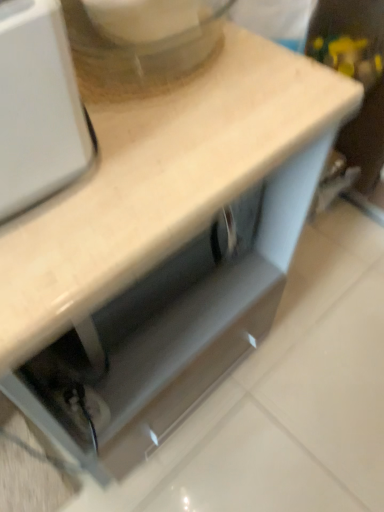
Question: Considering their positions, is white plastic mixer at upper left located in front of or behind white matte countertop at upper center?

Choices:
 (A) front
 (B) behind

Answer: (B)

Question: Looking at the image, does white plastic mixer at upper left seem bigger or smaller compared to white matte countertop at upper center?

Choices:
 (A) small
 (B) big

Answer: (A)

Question: From a real-world perspective, is white plastic mixer at upper left above or below white matte countertop at upper center?

Choices:
 (A) above
 (B) below

Answer: (A)

Question: From the image's perspective, is white matte countertop at upper center above or below white plastic mixer at upper left?

Choices:
 (A) above
 (B) below

Answer: (B)

Question: Looking at their shapes, would you say white matte countertop at upper center is wider or thinner than white plastic mixer at upper left?

Choices:
 (A) thin
 (B) wide

Answer: (B)

Question: Would you say white matte countertop at upper center is inside or outside white plastic mixer at upper left?

Choices:
 (A) outside
 (B) inside

Answer: (A)

Question: In terms of size, does white matte countertop at upper center appear bigger or smaller than white plastic mixer at upper left?

Choices:
 (A) small
 (B) big

Answer: (B)